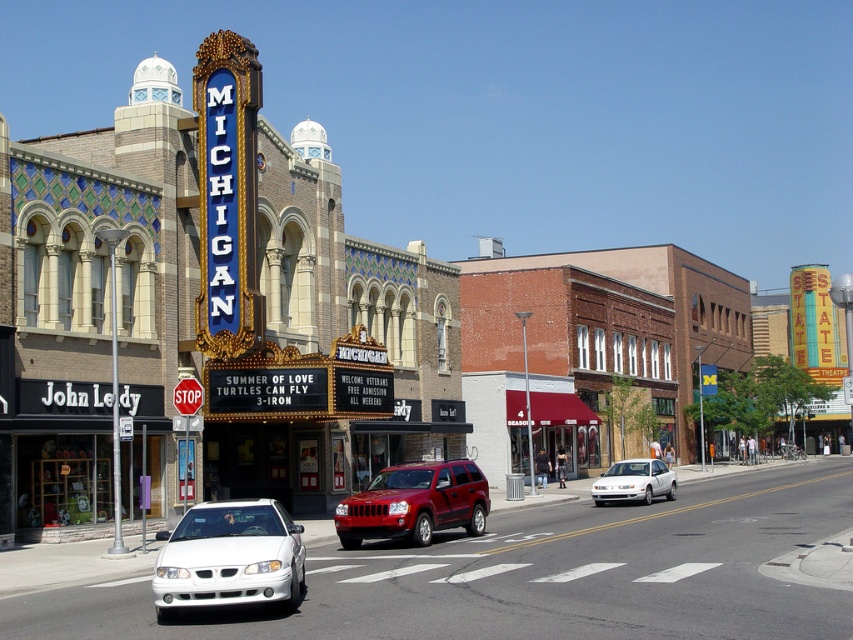
You are standing on the sidewalk in front of the Michigan theater and want to cross the street to reach the shiny red suv at center. The crosswalk is 70 feet long. Can you safely cross the crosswalk to reach the suv before the traffic light turns red?

The shiny red suv at center is 67.36 feet away from you. Since the crosswalk is 70 feet long, you can safely cross the crosswalk to reach the suv before the traffic light turns red because the distance to the suv is shorter than the crosswalk length.

You are a delivery person needing to park your 2.5 meter wide van. There is a parking spot between the white glossy sedan at lower left and the shiny red suv at center. Can your van fit there?

The white glossy sedan at lower left is wider than the shiny red suv at center. Since the sedan is wider, the space between them might be narrower than the SUV. However, without knowing the exact distance between the vehicles, it is uncertain if the 2.5 meter wide van can fit. Please check the available space physically before attempting to park.